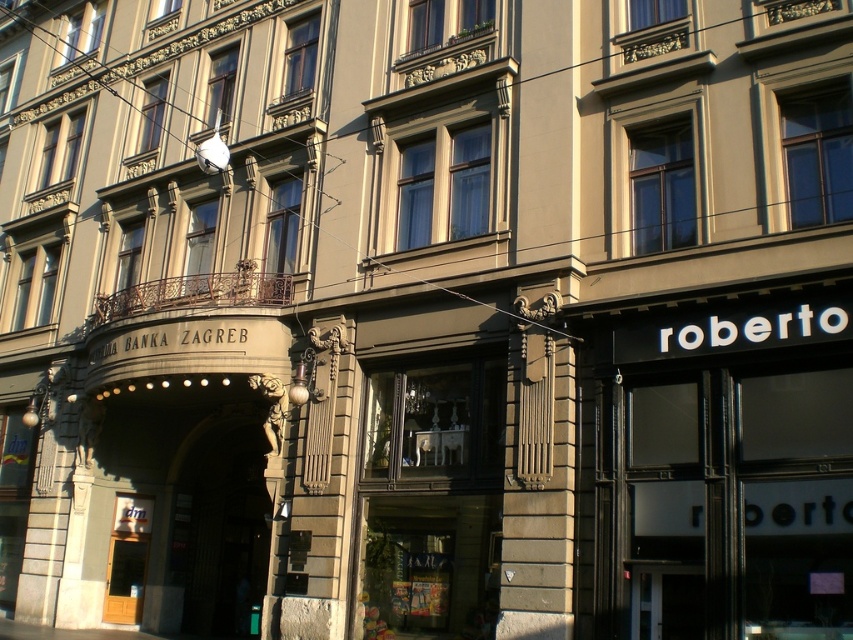
Can you confirm if black glass door at right is taller than matte glass window at center?

Indeed, black glass door at right has a greater height compared to matte glass window at center.

You are a GUI agent. You are given a task and a screenshot of the screen. Output one action in this format:
    pyautogui.click(x=<x>, y=<y>)
    Task: Click on the black glass door at right
    This screenshot has width=853, height=640.
    Given the screenshot: What is the action you would take?
    pyautogui.click(x=718, y=468)

In order to click on black glass door at right in this screenshot , I will do `click(718, 468)`.